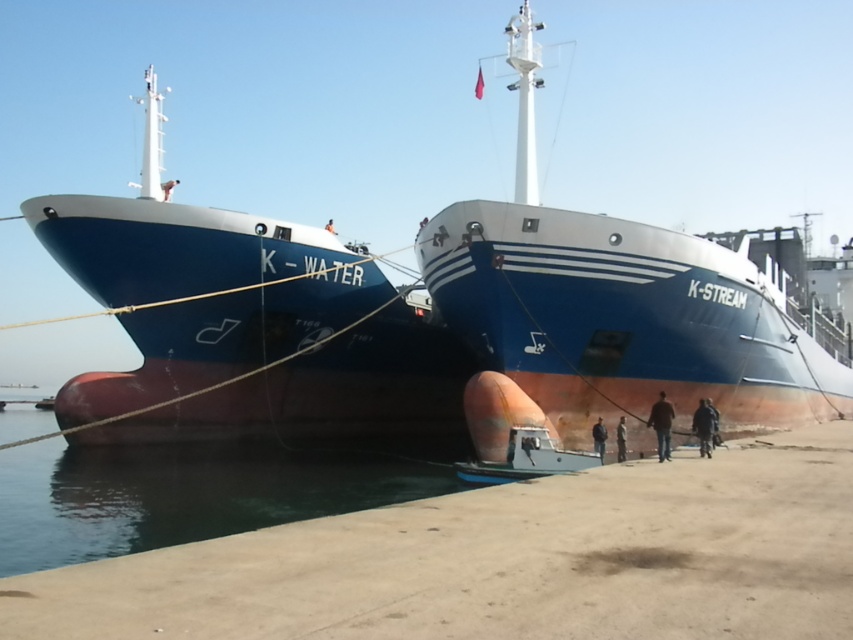
You are a crane operator trying to lower a cargo container onto the deck of the ship. The crane has a maximum reach of 8 meters. Based on the scene, can you safely lower the container onto the deck without hitting the dark brown water at lower center?

The distance between the dark brown water at lower center and the camera is 8.45 meters, which exceeds the crane operator maximum reach of 8 meters. Therefore, the crane cannot safely lower the container onto the deck without hitting the dark brown water at lower center.

In the scene shown: You are standing on the dock and want to reach the point marked at coordinates (660,433). If your current position is 30 feet away from the dock edge, can you safely reach that point without entering the water?

The distance between you and the point is 44.09 feet. Since you are 30 feet away from the dock edge, the remaining distance to the point is 14.09 feet. However, without knowing the water depth or the ship structure at that point, it is unsafe to assume you can reach it without entering the water.

You are a crane operator tasked with lifting a container from the deck of the blue matte ship at left. The crane has a maximum reach of 15 meters. Can you safely lift the container without moving the crane closer to the ship?

The distance between the blue matte ship at left and the camera is 16.11 meters. Since the crane can only reach 15 meters, it cannot safely lift the container from the blue matte ship at left without moving closer.